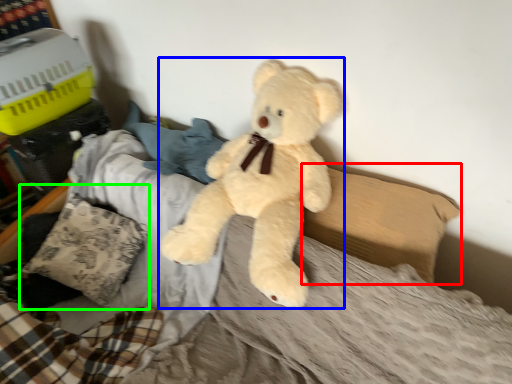
Question: Which is nearer to the pillow (highlighted by a red box)? teddy bear (highlighted by a blue box) or pillow (highlighted by a green box).

Choices:
 (A) teddy bear
 (B) pillow

Answer: (A)